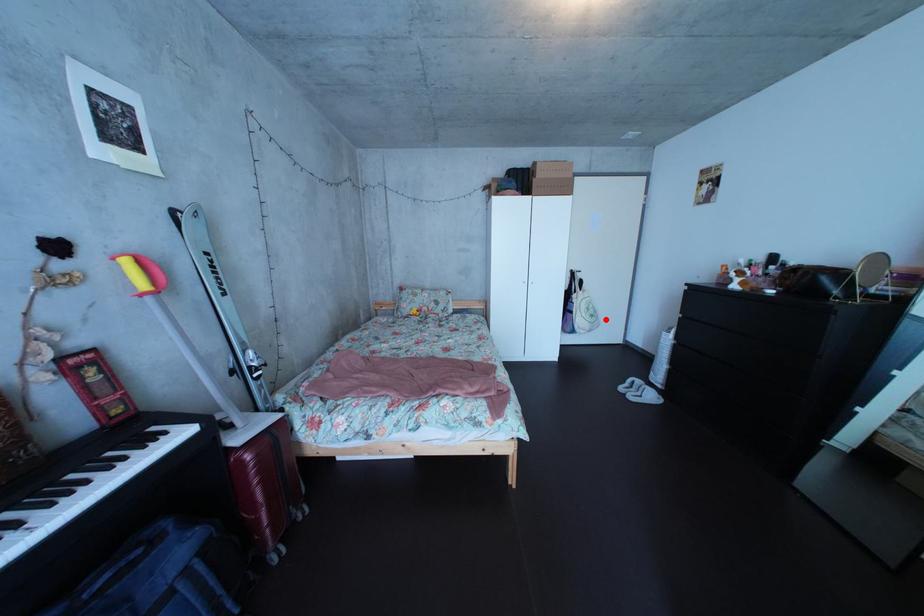
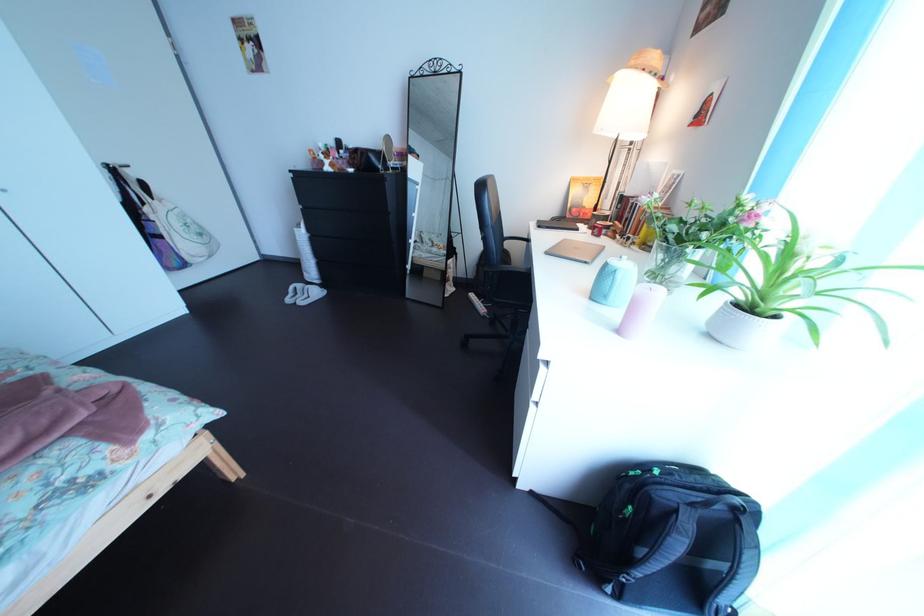
Where in the second image is the point corresponding to the highlighted location from the first image?

(209, 237)